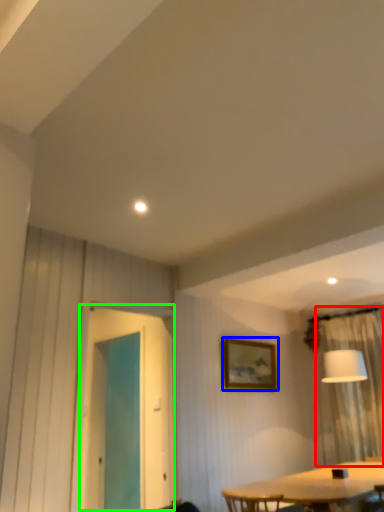
Question: Which is farther away from curtain (highlighted by a red box)? picture frame (highlighted by a blue box) or screen door (highlighted by a green box)?

Choices:
 (A) picture frame
 (B) screen door

Answer: (B)